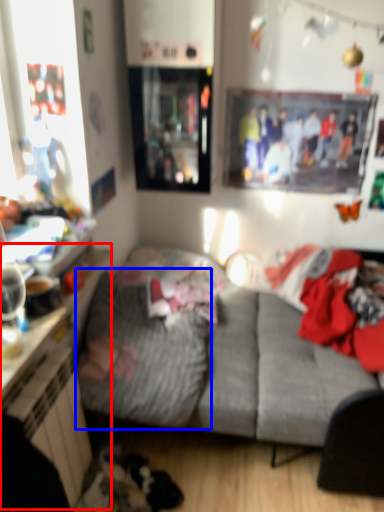
Question: Among these objects, which one is nearest to the camera, dresser (highlighted by a red box) or blanket (highlighted by a blue box)?

Choices:
 (A) dresser
 (B) blanket

Answer: (A)